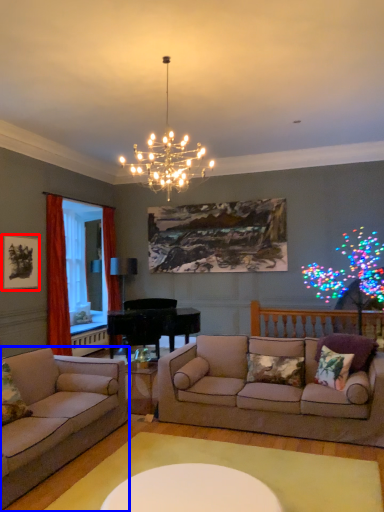
Question: Which object is further to the camera taking this photo, picture frame (highlighted by a red box) or studio couch (highlighted by a blue box)?

Choices:
 (A) picture frame
 (B) studio couch

Answer: (A)